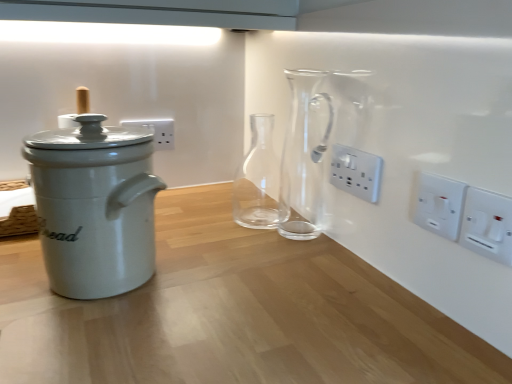
What do you see at coordinates (302, 157) in the screenshot? This screenshot has height=384, width=512. I see `transparent glass carafe at center, the 2th glass vase in the back-to-front sequence` at bounding box center [302, 157].

Describe the element at coordinates (356, 172) in the screenshot. I see `white plastic electrical outlet at center-right, arranged as the first electric outlet when viewed from the left` at that location.

This screenshot has height=384, width=512. What do you see at coordinates (95, 206) in the screenshot?
I see `white ceramic bread bin at left` at bounding box center [95, 206].

What do you see at coordinates (19, 221) in the screenshot? The width and height of the screenshot is (512, 384). I see `brown woven basket at left` at bounding box center [19, 221].

You are a GUI agent. You are given a task and a screenshot of the screen. Output one action in this format:
    pyautogui.click(x=<x>, y=<y>)
    Task: Click on the white plastic switch at right, the 1th electric outlet positioned from the right
    The height and width of the screenshot is (384, 512).
    Given the screenshot: What is the action you would take?
    pyautogui.click(x=487, y=225)

Can you confirm if white plastic electrical outlet at center-right, the 1th electric outlet in the back-to-front sequence, is thinner than transparent glass carafe at center, the first glass vase positioned from the front?

Yes, white plastic electrical outlet at center-right, the 1th electric outlet in the back-to-front sequence, is thinner than transparent glass carafe at center, the first glass vase positioned from the front.

Considering the relative sizes of white plastic electrical outlet at center-right, the 1th electric outlet in the back-to-front sequence, and transparent glass carafe at center, the 2th glass vase in the back-to-front sequence, in the image provided, is white plastic electrical outlet at center-right, the 1th electric outlet in the back-to-front sequence, shorter than transparent glass carafe at center, the 2th glass vase in the back-to-front sequence,?

Yes, white plastic electrical outlet at center-right, the 1th electric outlet in the back-to-front sequence, is shorter than transparent glass carafe at center, the 2th glass vase in the back-to-front sequence.

This screenshot has width=512, height=384. There is a transparent glass carafe at center, the first glass vase positioned from the front. Find the location of `the 1st electric outlet below it (from the image's perspective)`. the 1st electric outlet below it (from the image's perspective) is located at coordinates (356, 172).

Consider the image. Is white plastic electrical outlet at center-right, the 1th electric outlet in the back-to-front sequence, behind transparent glass carafe at center, the first glass vase positioned from the front?

Yes, white plastic electrical outlet at center-right, the 1th electric outlet in the back-to-front sequence, is further from the camera.

How different are the orientations of transparent glass carafe at center, the first glass vase positioned from the front, and white plastic electrical outlet at center-right, the 1th electric outlet in the back-to-front sequence, in degrees?

They differ by 1.17 degrees in their facing directions.

Consider the image. From a real-world perspective, is transparent glass carafe at center, the first glass vase positioned from the front, on top of white plastic electrical outlet at center-right, the 3th electric outlet viewed from the right?

Yes, from a real-world perspective, transparent glass carafe at center, the first glass vase positioned from the front, is over white plastic electrical outlet at center-right, the 3th electric outlet viewed from the right

Is transparent glass carafe at center, the 2th glass vase in the back-to-front sequence, inside the boundaries of white plastic electrical outlet at center-right, arranged as the first electric outlet when viewed from the left, or outside?

transparent glass carafe at center, the 2th glass vase in the back-to-front sequence, is located beyond the bounds of white plastic electrical outlet at center-right, arranged as the first electric outlet when viewed from the left.

Which object is wider, transparent glass carafe at center, the 2th glass vase in the back-to-front sequence, or white plastic electrical outlet at center-right, the 3th electric outlet when ordered from front to back?

transparent glass carafe at center, the 2th glass vase in the back-to-front sequence.

In the scene shown: Considering the sizes of objects white plastic switch at right, which is the 3th electric outlet in back-to-front order, and transparent glass carafe at center, the first glass vase positioned from the front, in the image provided, who is shorter, white plastic switch at right, which is the 3th electric outlet in back-to-front order, or transparent glass carafe at center, the first glass vase positioned from the front,?

Standing shorter between the two is white plastic switch at right, which is the 3th electric outlet in back-to-front order.

From a real-world perspective, which is physically below, white plastic switch at right, the first electric outlet viewed from the front, or transparent glass carafe at center, the first glass vase positioned from the front?

In real-world perspective, white plastic switch at right, the first electric outlet viewed from the front, is lower.

From the image's perspective, which object appears higher, white plastic switch at right, the first electric outlet viewed from the front, or transparent glass carafe at center, the first glass vase positioned from the front?

transparent glass carafe at center, the first glass vase positioned from the front, from the image's perspective.

From a real-world perspective, is white plastic switch at right, the 1th electric outlet positioned from the right, above or below white ceramic bread bin at left?

white plastic switch at right, the 1th electric outlet positioned from the right, is situated higher than white ceramic bread bin at left in the real world.

Between white plastic switch at right, the first electric outlet viewed from the front, and white ceramic bread bin at left, which one is positioned behind?

white ceramic bread bin at left is further away from the camera.

Considering the sizes of white plastic switch at right, the 3th electric outlet from the left, and white ceramic bread bin at left in the image, is white plastic switch at right, the 3th electric outlet from the left, taller or shorter than white ceramic bread bin at left?

Considering their sizes, white plastic switch at right, the 3th electric outlet from the left, has less height than white ceramic bread bin at left.

Considering the sizes of objects white plastic switch at right, the 3th electric outlet from the left, and white ceramic bread bin at left in the image provided, who is thinner, white plastic switch at right, the 3th electric outlet from the left, or white ceramic bread bin at left?

With smaller width is white plastic switch at right, the 3th electric outlet from the left.

From a real-world perspective, who is located lower, white plastic electrical outlet at center-right, the 1th electric outlet in the back-to-front sequence, or white plastic switch at right, the 2th electric outlet in the left-to-right sequence?

In real-world perspective, white plastic switch at right, the 2th electric outlet in the left-to-right sequence, is lower.

Considering the points (374, 166) and (444, 210), which point is behind, point (374, 166) or point (444, 210)?

Positioned behind is point (374, 166).

Does white plastic electrical outlet at center-right, the 3th electric outlet when ordered from front to back, have a greater height compared to white plastic switch at right, which is the second electric outlet in right-to-left order?

In fact, white plastic electrical outlet at center-right, the 3th electric outlet when ordered from front to back, may be shorter than white plastic switch at right, which is the second electric outlet in right-to-left order.

Is brown woven basket at left wider or thinner than white ceramic bread bin at left?

Considering their sizes, brown woven basket at left looks broader than white ceramic bread bin at left.

Considering the relative positions of brown woven basket at left and white ceramic bread bin at left in the image provided, is brown woven basket at left to the left of white ceramic bread bin at left from the viewer's perspective?

Yes, brown woven basket at left is to the left of white ceramic bread bin at left.

Looking at this image, considering the relative sizes of brown woven basket at left and white ceramic bread bin at left in the image provided, is brown woven basket at left taller than white ceramic bread bin at left?

No.

From the image's perspective, does brown woven basket at left appear higher than white ceramic bread bin at left?

No.

Does transparent glass carafe at center, the 2th glass vase in the front-to-back sequence, have a smaller size compared to white plastic switch at right, the 2th electric outlet in the left-to-right sequence?

Incorrect, transparent glass carafe at center, the 2th glass vase in the front-to-back sequence, is not smaller in size than white plastic switch at right, the 2th electric outlet in the left-to-right sequence.

Are transparent glass carafe at center, which is the first glass vase from back to front, and white plastic switch at right, which is the 2th electric outlet in back-to-front order, located far from each other?

No, transparent glass carafe at center, which is the first glass vase from back to front, is not far from white plastic switch at right, which is the 2th electric outlet in back-to-front order.

Is point (250, 212) farther from camera compared to point (417, 219)?

Yes.

In terms of width, does transparent glass carafe at center, which is the first glass vase from back to front, look wider or thinner when compared to white plastic switch at right, which is the 2th electric outlet in back-to-front order?

transparent glass carafe at center, which is the first glass vase from back to front, is wider than white plastic switch at right, which is the 2th electric outlet in back-to-front order.

The image size is (512, 384). There is a transparent glass carafe at center, the first glass vase positioned from the front. In order to click on the 1st electric outlet below it (from the image's perspective) in this screenshot , I will do `click(356, 172)`.

You are a GUI agent. You are given a task and a screenshot of the screen. Output one action in this format:
    pyautogui.click(x=<x>, y=<y>)
    Task: Click on the electric outlet that is the 1st object to the right of the transparent glass carafe at center, the 2th glass vase in the back-to-front sequence, starting at the anchor
    This screenshot has height=384, width=512.
    Given the screenshot: What is the action you would take?
    pyautogui.click(x=356, y=172)

Looking at the image, which one is located further to brown woven basket at left, white plastic electrical outlet at center-right, the 1th electric outlet in the back-to-front sequence, or transparent glass carafe at center, the first glass vase positioned from the front?

Based on the image, white plastic electrical outlet at center-right, the 1th electric outlet in the back-to-front sequence, appears to be further to brown woven basket at left.

When comparing their distances from transparent glass carafe at center, the 2th glass vase in the back-to-front sequence, does white plastic switch at right, which is the second electric outlet in right-to-left order, or white plastic electrical outlet at center-right, arranged as the first electric outlet when viewed from the left, seem closer?

white plastic electrical outlet at center-right, arranged as the first electric outlet when viewed from the left.

Looking at the image, which one is located closer to transparent glass carafe at center, the first glass vase positioned from the front, white plastic electrical outlet at center-right, the 3th electric outlet when ordered from front to back, or brown woven basket at left?

white plastic electrical outlet at center-right, the 3th electric outlet when ordered from front to back.

Which object lies nearer to the anchor point transparent glass carafe at center, the 2th glass vase in the front-to-back sequence, brown woven basket at left or white plastic switch at right, arranged as the second electric outlet when viewed from the front?

The object closer to transparent glass carafe at center, the 2th glass vase in the front-to-back sequence, is brown woven basket at left.

Considering their positions, is white plastic switch at right, the 2th electric outlet in the left-to-right sequence, positioned further to transparent glass carafe at center, which is the first glass vase from back to front, than white plastic electrical outlet at center-right, arranged as the first electric outlet when viewed from the left?

The object further to transparent glass carafe at center, which is the first glass vase from back to front, is white plastic switch at right, the 2th electric outlet in the left-to-right sequence.

Which object lies nearer to the anchor point brown woven basket at left, transparent glass carafe at center, the 2th glass vase in the back-to-front sequence, or white ceramic bread bin at left?

white ceramic bread bin at left is closer to brown woven basket at left.

Which object lies further to the anchor point white plastic switch at right, the 3th electric outlet from the left, white ceramic bread bin at left or transparent glass carafe at center, which is the first glass vase from back to front?

The object further to white plastic switch at right, the 3th electric outlet from the left, is transparent glass carafe at center, which is the first glass vase from back to front.

Based on their spatial positions, is white plastic switch at right, the 1th electric outlet positioned from the right, or white plastic switch at right, which is the second electric outlet in right-to-left order, further from brown woven basket at left?

Among the two, white plastic switch at right, the 1th electric outlet positioned from the right, is located further to brown woven basket at left.

Locate an element on the screen. glass vase between white plastic switch at right, the first electric outlet viewed from the front, and white plastic electrical outlet at center-right, the 3th electric outlet viewed from the right, from front to back is located at coordinates (302, 157).

In order to click on kitchen appliance situated between brown woven basket at left and white plastic switch at right, the first electric outlet viewed from the front, from left to right in this screenshot , I will do `click(95, 206)`.

You are a GUI agent. You are given a task and a screenshot of the screen. Output one action in this format:
    pyautogui.click(x=<x>, y=<y>)
    Task: Click on the glass vase positioned between white plastic switch at right, which is the second electric outlet in right-to-left order, and white plastic electrical outlet at center-right, the 3th electric outlet viewed from the right, from near to far
    
    Given the screenshot: What is the action you would take?
    pyautogui.click(x=302, y=157)

At what (x,y) coordinates should I click in order to perform the action: click on glass vase located between white ceramic bread bin at left and transparent glass carafe at center, the first glass vase positioned from the front, in the left-right direction. Please return your answer as a coordinate pair (x, y). Image resolution: width=512 pixels, height=384 pixels. Looking at the image, I should click on (258, 179).